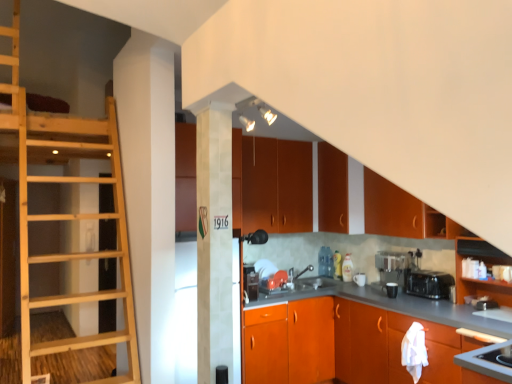
You are a GUI agent. You are given a task and a screenshot of the screen. Output one action in this format:
    pyautogui.click(x=<x>, y=<y>)
    Task: Click on the free point in front of matte black coffee maker at lower center, marked as the second appliance in a left-to-right arrangement
    This screenshot has width=512, height=384.
    Given the screenshot: What is the action you would take?
    pyautogui.click(x=397, y=302)